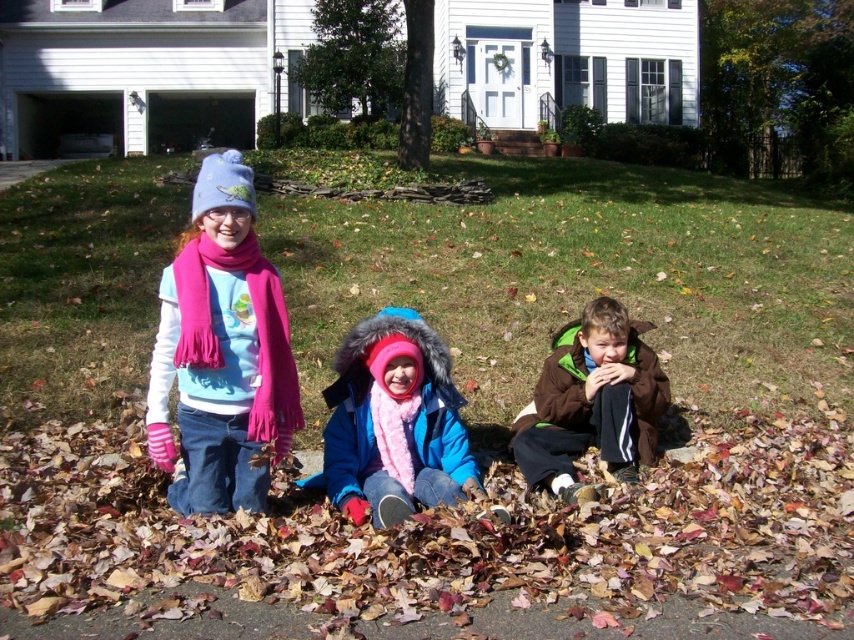
Question: Where is matte pink scarf at left located in relation to blue fuzzy coat at center in the image?

Choices:
 (A) above
 (B) below

Answer: (A)

Question: Which point appears farthest from the camera in this image?

Choices:
 (A) (524, 424)
 (B) (249, 472)
 (C) (364, 465)

Answer: (A)

Question: Which is farther from the green grass at center?

Choices:
 (A) blue fuzzy coat at center
 (B) brown fleece jacket at lower right
 (C) matte pink scarf at left

Answer: (C)

Question: Among these objects, which one is farthest from the camera?

Choices:
 (A) brown fleece jacket at lower right
 (B) green grass at center
 (C) matte pink scarf at left

Answer: (B)

Question: Is matte pink scarf at left further to the viewer compared to blue fuzzy coat at center?

Choices:
 (A) yes
 (B) no

Answer: (B)

Question: Is matte pink scarf at left below blue fuzzy coat at center?

Choices:
 (A) yes
 (B) no

Answer: (B)